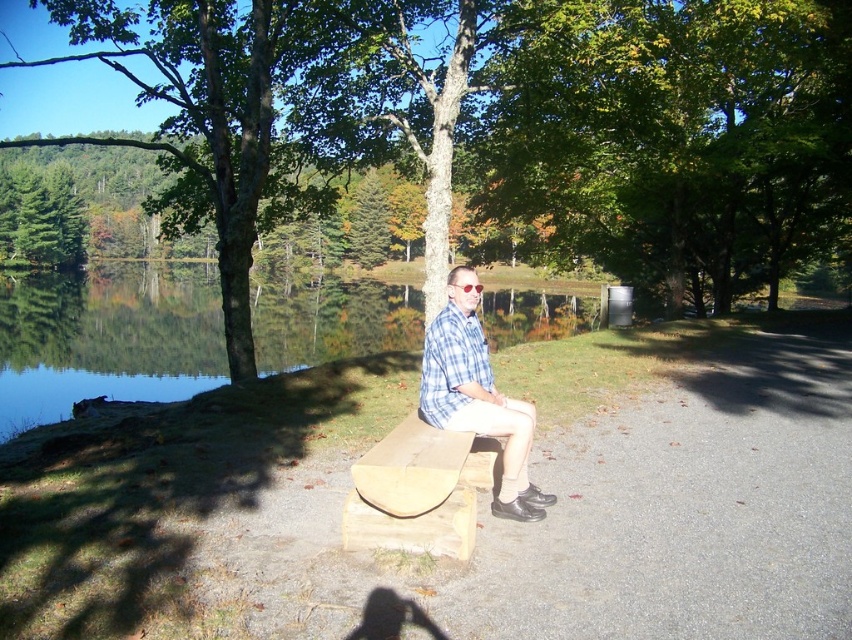
Is the position of green textured tree at center less distant than that of clear water at bench left?

That is True.

Describe the element at coordinates (510, 125) in the screenshot. I see `green textured tree at center` at that location.

Locate an element on the screen. green textured tree at center is located at coordinates (510, 125).

Between point (106, 304) and point (491, 480), which one is positioned behind?

Positioned behind is point (106, 304).

Which is in front, point (105, 360) or point (417, 432)?

Positioned in front is point (417, 432).

I want to click on clear water at bench left, so click(106, 339).

Measure the distance between point (655, 241) and camera.

A distance of 30.72 meters exists between point (655, 241) and camera.

Is green textured tree at center wider than light brown wooden bench at center?

Indeed, green textured tree at center has a greater width compared to light brown wooden bench at center.

This screenshot has width=852, height=640. Describe the element at coordinates (510, 125) in the screenshot. I see `green textured tree at center` at that location.

You are a GUI agent. You are given a task and a screenshot of the screen. Output one action in this format:
    pyautogui.click(x=<x>, y=<y>)
    Task: Click on the green textured tree at center
    This screenshot has height=640, width=852.
    Given the screenshot: What is the action you would take?
    pyautogui.click(x=510, y=125)